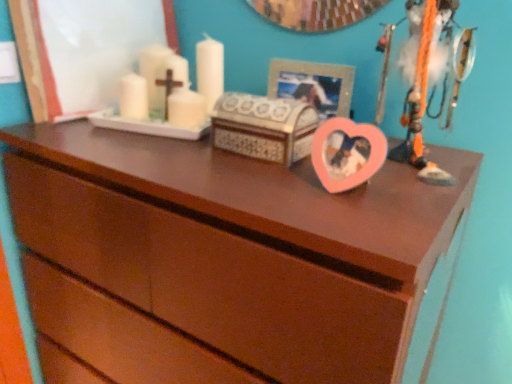
Question: Do you think brown wood chest of drawers at center is within metallic silver picture frame at upper center, or outside of it?

Choices:
 (A) outside
 (B) inside

Answer: (A)

Question: From a real-world perspective, is brown wood chest of drawers at center positioned above or below metallic silver picture frame at upper center?

Choices:
 (A) above
 (B) below

Answer: (B)

Question: Estimate the real-world distances between objects in this image. Which object is farther from the metallic silver picture frame at upper center?

Choices:
 (A) brown wood chest of drawers at center
 (B) pink plastic heart at upper right

Answer: (A)

Question: Estimate the real-world distances between objects in this image. Which object is farther from the brown wood chest of drawers at center?

Choices:
 (A) pink plastic heart at upper right
 (B) metallic silver picture frame at upper center

Answer: (B)